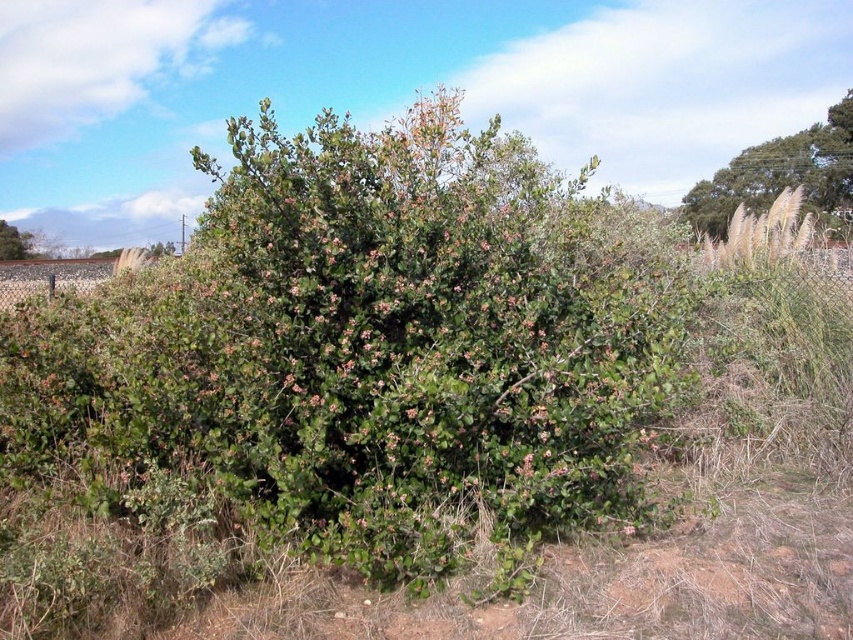
You are a gardener planning to trim both the green leafy bush at upper right and the green leafy bush at left. Based on their sizes, which bush requires more pruning shears to handle thicker branches?

The green leafy bush at left requires more pruning shears to handle thicker branches because it is larger than the green leafy bush at upper right.

You are a gardener planning to trim both the green leafy bush at upper right and the green leafy bush at left. Based on their sizes, which bush will require more time to trim?

The green leafy bush at left will require more time to trim since it is thicker than the green leafy bush at upper right.

From the picture: You are standing in a garden and want to water the green leafy bush at upper right and the green leafy bush at left. Which bush should you water first if you want to start with the one closer to you?

You should water the green leafy bush at upper right first because it is closer to you than the green leafy bush at left.